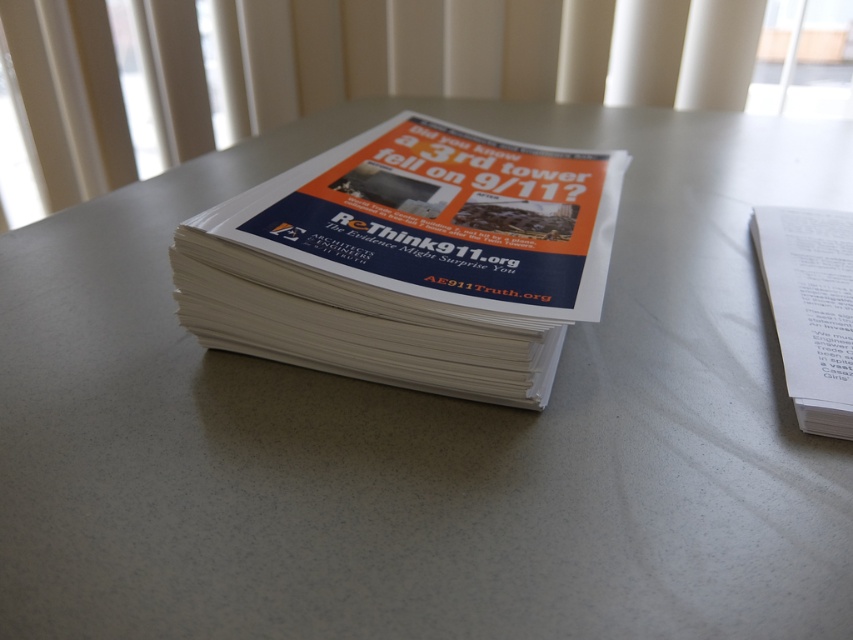
Question: Does white paper flyer at center have a lesser width compared to white paper at right?

Choices:
 (A) no
 (B) yes

Answer: (A)

Question: Among these objects, which one is farthest from the camera?

Choices:
 (A) white paper flyer at center
 (B) white paper at right

Answer: (A)

Question: In this image, where is white paper flyer at center located relative to white paper at right?

Choices:
 (A) below
 (B) above

Answer: (B)

Question: Is white paper flyer at center wider than white paper at right?

Choices:
 (A) yes
 (B) no

Answer: (A)